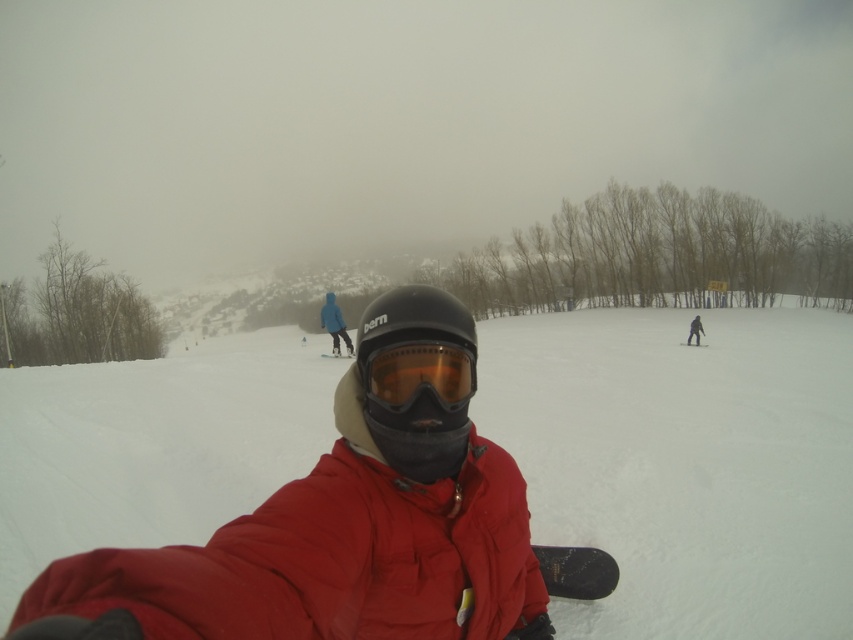
Question: Is matte black helmet at center wider than blue fabric snowsuit at center?

Choices:
 (A) yes
 (B) no

Answer: (B)

Question: Which point is farther to the camera?

Choices:
 (A) (335, 308)
 (B) (689, 339)
 (C) (431, 365)
 (D) (706, 346)

Answer: (B)

Question: In this image, where is white matte snowboard at center located relative to orange tinted plastic goggles at center?

Choices:
 (A) above
 (B) below

Answer: (B)

Question: Is blue glossy snowboard at center to the right of matte black snowboard at center from the viewer's perspective?

Choices:
 (A) no
 (B) yes

Answer: (A)

Question: Which point appears closest to the camera in this image?

Choices:
 (A) (344, 356)
 (B) (689, 346)
 (C) (445, 376)

Answer: (C)

Question: Which object appears farthest from the camera in this image?

Choices:
 (A) orange tinted plastic goggles at center
 (B) white matte snowboard at center
 (C) blue glossy snowboard at center
 (D) blue fabric snowsuit at center

Answer: (C)